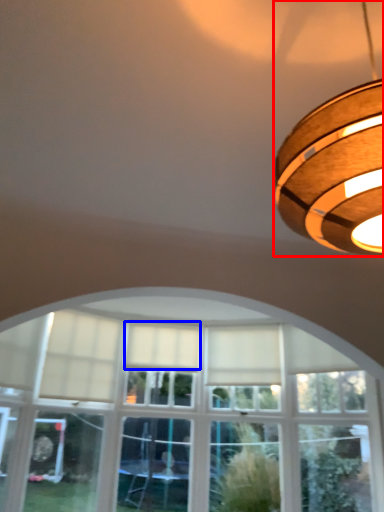
Question: Which point is further to the camera, lamp (highlighted by a red box) or curtain (highlighted by a blue box)?

Choices:
 (A) lamp
 (B) curtain

Answer: (B)